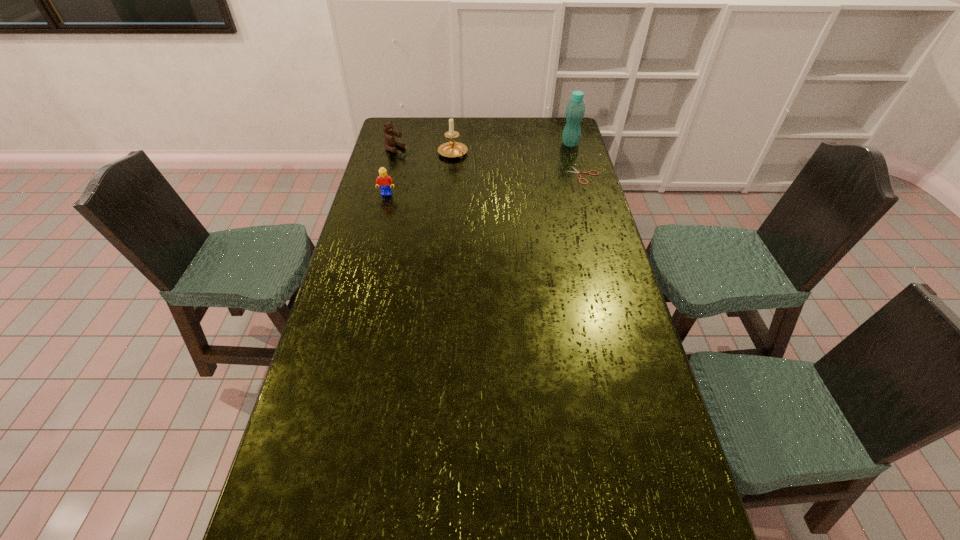
Where is `the nearest object`? This screenshot has width=960, height=540. the nearest object is located at coordinates (385, 182).

The width and height of the screenshot is (960, 540). I want to click on the shortest object, so click(x=577, y=171).

Where is `the fourth farthest object`? This screenshot has height=540, width=960. the fourth farthest object is located at coordinates (577, 171).

In order to click on the tallest object in this screenshot , I will do `click(575, 110)`.

Identify the location of the fourth shortest object. Image resolution: width=960 pixels, height=540 pixels. (450, 149).

Image resolution: width=960 pixels, height=540 pixels. I want to click on the third object from left to right, so click(x=450, y=149).

The width and height of the screenshot is (960, 540). I want to click on teddy bear, so click(x=390, y=141).

Where is `vacant space located on the front-facing side of the Lego`? This screenshot has height=540, width=960. vacant space located on the front-facing side of the Lego is located at coordinates (373, 246).

At what (x,y) coordinates should I click in order to perform the action: click on vacant space located on the front of the fourth farthest object. Please return your answer as a coordinate pair (x, y). Looking at the image, I should click on (x=591, y=205).

Locate an element on the screen. Image resolution: width=960 pixels, height=540 pixels. vacant space situated at the front cap of the water bottle is located at coordinates (537, 165).